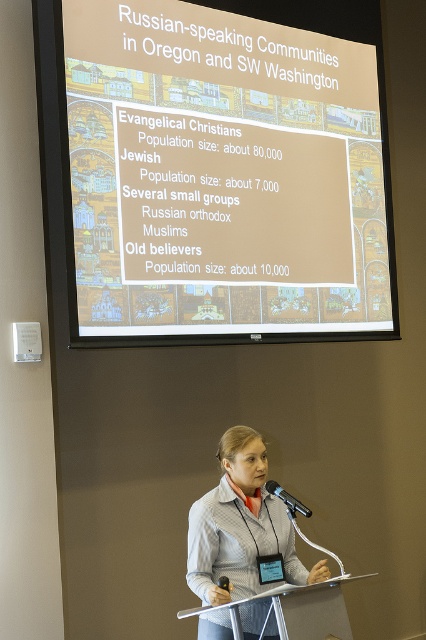
You are a photographer setting up for a presentation. You need to ensure that the gray fabric jacket at center and the black metallic microphone at center are both visible in the photo. Given that the camera can only focus on objects within a 1.5 meter width, will both items fit within this focus range?

The gray fabric jacket at center has a larger width than the black metallic microphone at center. However, since the camera can focus on objects within a 1.5 meter width, both items should fit as long as their combined or individual widths do not exceed the limit. The exact dimensions are not provided, so we assume they are within the range.

You are an event planner setting up for a presentation. You need to ensure that the white matte projection screen at upper center and the black metallic microphone at center are visible to all attendees. Considering their sizes, which object might require a different placement strategy to ensure visibility?

The white matte projection screen at upper center is much taller than the black metallic microphone at center, so it might require a higher placement or positioning away from obstructions to ensure all attendees can see it clearly.